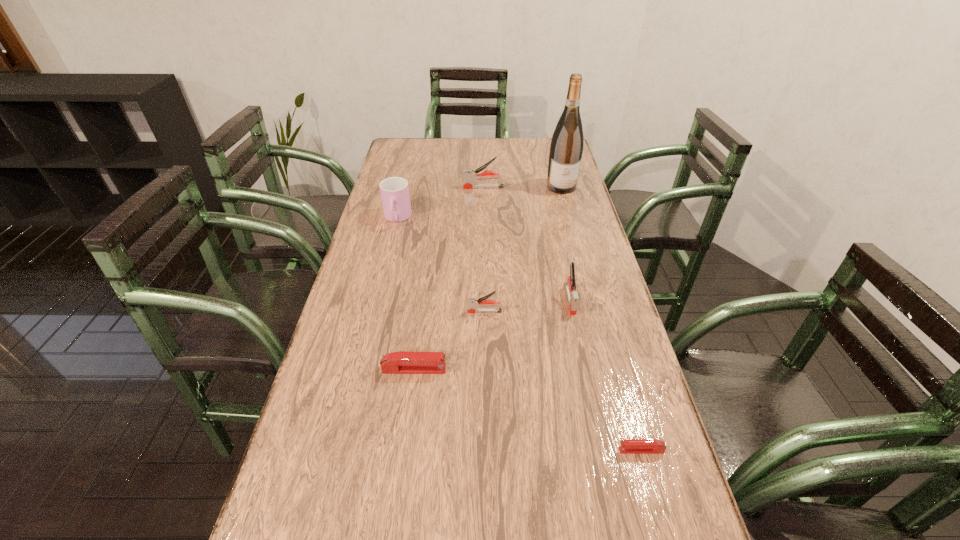
You are a GUI agent. You are given a task and a screenshot of the screen. Output one action in this format:
    pyautogui.click(x=<x>, y=<y>)
    Task: Click on the vacant area that lies between the fourth tallest object and the farther red stapler
    The height and width of the screenshot is (540, 960).
    Given the screenshot: What is the action you would take?
    pyautogui.click(x=492, y=334)

Where is `vacant space that is in between the tallest object and the cup`? The width and height of the screenshot is (960, 540). vacant space that is in between the tallest object and the cup is located at coordinates (479, 202).

At what (x,y) coordinates should I click in order to perform the action: click on free space that is in between the leftmost object and the rightmost gray stapler. Please return your answer as a coordinate pair (x, y). The width and height of the screenshot is (960, 540). Looking at the image, I should click on point(484,259).

At what (x,y) coordinates should I click in order to perform the action: click on the closest object to the smallest gray stapler. Please return your answer as a coordinate pair (x, y). Looking at the image, I should click on (402, 362).

At what (x,y) coordinates should I click in order to perform the action: click on object that ranks as the closest to the nearest stapler. Please return your answer as a coordinate pair (x, y). Looking at the image, I should click on (570, 285).

Find the location of a particular element. The width and height of the screenshot is (960, 540). stapler object that ranks as the fourth closest to the leftmost object is located at coordinates (402, 362).

Identify the location of stapler that can be found as the second closest to the fourth stapler from left to right. This screenshot has height=540, width=960. (402, 362).

The width and height of the screenshot is (960, 540). I want to click on the second closest gray stapler relative to the nearer red stapler, so (x=473, y=303).

Find the location of a particular element. the third closest gray stapler to the cup is located at coordinates (570, 285).

Image resolution: width=960 pixels, height=540 pixels. What are the coordinates of `red stapler that is the second closest to the rightmost gray stapler` in the screenshot? It's located at (628, 446).